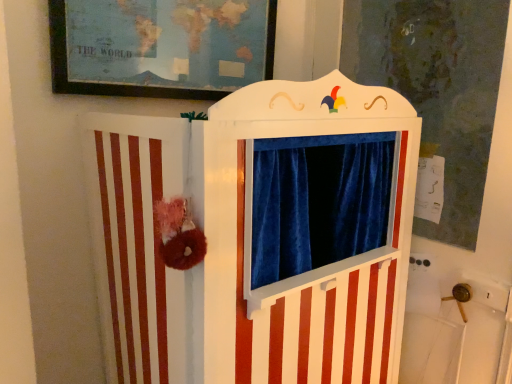
Image resolution: width=512 pixels, height=384 pixels. What do you see at coordinates (256, 236) in the screenshot?
I see `white wood puppet theater at center` at bounding box center [256, 236].

In the scene shown: Measure the distance between point (393, 316) and camera.

1.40 meters.

The image size is (512, 384). In order to click on white wood puppet theater at center in this screenshot , I will do `click(256, 236)`.

Identify the location of matte paper map at upper center. (161, 46).

What do you see at coordinates (161, 46) in the screenshot? I see `matte paper map at upper center` at bounding box center [161, 46].

I want to click on white wood puppet theater at center, so click(256, 236).

Which is more to the right, white wood puppet theater at center or matte paper map at upper center?

Positioned to the right is white wood puppet theater at center.

Considering their positions, is white wood puppet theater at center located in front of or behind matte paper map at upper center?

Visually, white wood puppet theater at center is located in front of matte paper map at upper center.

Which is closer, (354, 283) or (128, 77)?

Point (354, 283) appears to be farther away from the viewer than point (128, 77).

From the image's perspective, is white wood puppet theater at center above or below matte paper map at upper center?

Clearly, from the image's perspective, white wood puppet theater at center is below matte paper map at upper center.

From a real-world perspective, is white wood puppet theater at center positioned under matte paper map at upper center based on gravity?

Indeed, from a real-world perspective, white wood puppet theater at center is positioned beneath matte paper map at upper center.

Considering the sizes of objects white wood puppet theater at center and matte paper map at upper center in the image provided, who is wider, white wood puppet theater at center or matte paper map at upper center?

white wood puppet theater at center is wider.

Is white wood puppet theater at center shorter than matte paper map at upper center?

No, white wood puppet theater at center is not shorter than matte paper map at upper center.

In terms of size, does white wood puppet theater at center appear bigger or smaller than matte paper map at upper center?

Clearly, white wood puppet theater at center is larger in size than matte paper map at upper center.

Can we say white wood puppet theater at center lies outside matte paper map at upper center?

Yes, white wood puppet theater at center is outside of matte paper map at upper center.

Is white wood puppet theater at center placed right next to matte paper map at upper center?

They are not placed beside each other.

Does white wood puppet theater at center turn towards matte paper map at upper center?

No, white wood puppet theater at center is not turned towards matte paper map at upper center.

What's the angular difference between white wood puppet theater at center and matte paper map at upper center's facing directions?

0.00469 degrees.

You are a GUI agent. You are given a task and a screenshot of the screen. Output one action in this format:
    pyautogui.click(x=<x>, y=<y>)
    Task: Click on the picture frame above the white wood puppet theater at center (from a real-world perspective)
    The height and width of the screenshot is (384, 512).
    Given the screenshot: What is the action you would take?
    pyautogui.click(x=161, y=46)

Between matte paper map at upper center and white wood puppet theater at center, which one appears on the left side from the viewer's perspective?

From the viewer's perspective, matte paper map at upper center appears more on the left side.

Which object is further away from the camera, matte paper map at upper center or white wood puppet theater at center?

matte paper map at upper center.

Considering the points (123, 57) and (145, 357), which point is in front, point (123, 57) or point (145, 357)?

The point (145, 357) is more forward.

From the image's perspective, relative to white wood puppet theater at center, is matte paper map at upper center above or below?

Clearly, from the image's perspective, matte paper map at upper center is above white wood puppet theater at center.

From a real-world perspective, is matte paper map at upper center beneath white wood puppet theater at center?

No.

Which object is wider, matte paper map at upper center or white wood puppet theater at center?

Wider between the two is white wood puppet theater at center.

Considering the sizes of objects matte paper map at upper center and white wood puppet theater at center in the image provided, who is taller, matte paper map at upper center or white wood puppet theater at center?

white wood puppet theater at center.

Which of these two, matte paper map at upper center or white wood puppet theater at center, is smaller?

matte paper map at upper center.

Is matte paper map at upper center situated inside white wood puppet theater at center or outside?

matte paper map at upper center lies outside white wood puppet theater at center.

In the scene shown: Is matte paper map at upper center far from white wood puppet theater at center?

No, there isn't a large distance between matte paper map at upper center and white wood puppet theater at center.

Is matte paper map at upper center oriented away from white wood puppet theater at center?

matte paper map at upper center is not turned away from white wood puppet theater at center.

Measure the distance between matte paper map at upper center and white wood puppet theater at center.

matte paper map at upper center is 20.30 inches from white wood puppet theater at center.

What are the coordinates of `furniture below the matte paper map at upper center (from the image's perspective)` in the screenshot? It's located at (256, 236).

This screenshot has width=512, height=384. What are the coordinates of `furniture that appears below the matte paper map at upper center (from the image's perspective)` in the screenshot? It's located at (256, 236).

You are a GUI agent. You are given a task and a screenshot of the screen. Output one action in this format:
    pyautogui.click(x=<x>, y=<y>)
    Task: Click on the picture frame lying on the left of white wood puppet theater at center
    The image size is (512, 384).
    Given the screenshot: What is the action you would take?
    (161, 46)